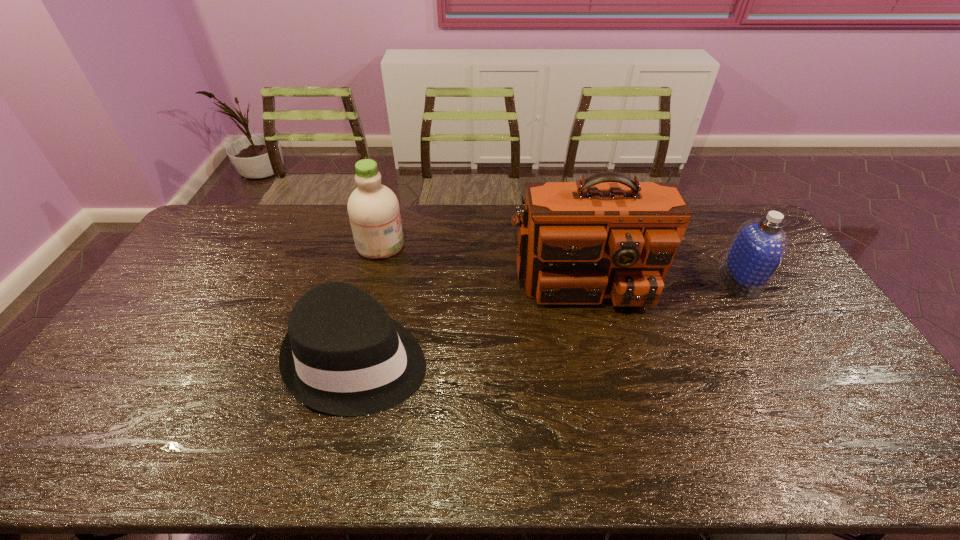
Locate an element on the screen. The width and height of the screenshot is (960, 540). vacant area situated 0.320m on the right of the fedora is located at coordinates (542, 359).

Find the location of `satchel located at the far edge`. satchel located at the far edge is located at coordinates (606, 236).

Find the location of `cleansing agent present at the far edge`. cleansing agent present at the far edge is located at coordinates (373, 209).

Find the location of a particular element. This screenshot has width=960, height=540. object situated at the right edge is located at coordinates (759, 246).

The height and width of the screenshot is (540, 960). What are the coordinates of `vacant space at the far edge of the desktop` in the screenshot? It's located at (426, 215).

The width and height of the screenshot is (960, 540). What are the coordinates of `vacant space at the near edge` in the screenshot? It's located at (831, 468).

You are a GUI agent. You are given a task and a screenshot of the screen. Output one action in this format:
    pyautogui.click(x=<x>, y=<y>)
    Task: Click on the blank area at the right edge
    Image resolution: width=960 pixels, height=540 pixels.
    Given the screenshot: What is the action you would take?
    pyautogui.click(x=784, y=287)

Where is `vacant region at the far left corner`? The height and width of the screenshot is (540, 960). vacant region at the far left corner is located at coordinates (210, 219).

Find the location of `vacant space at the near left corner of the desktop`. vacant space at the near left corner of the desktop is located at coordinates (60, 453).

The height and width of the screenshot is (540, 960). In order to click on vacant space at the near right corner of the desktop in this screenshot , I will do `click(886, 442)`.